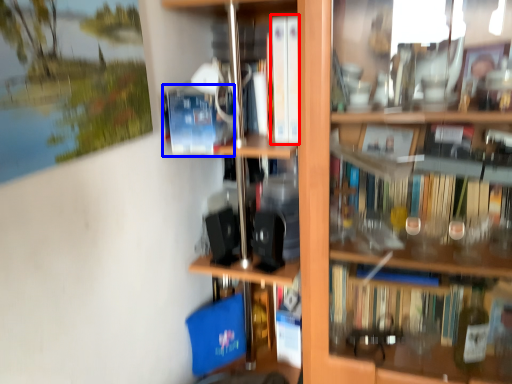
Question: Which object appears closest to the camera in this image, book (highlighted by a red box) or paperback book (highlighted by a blue box)?

Choices:
 (A) book
 (B) paperback book

Answer: (B)